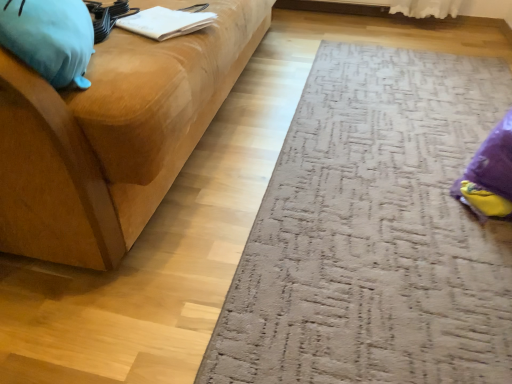
Measure the distance between textured gray doormat at lower right and camera.

The distance of textured gray doormat at lower right from camera is 32.95 inches.

In order to face matte wood studio couch at left, should I rotate leftwards or rightwards?

You should rotate left by 17.257 degrees.

In order to click on soft blue plush at left in this screenshot , I will do `click(50, 38)`.

From the image's perspective, is textured gray doormat at lower right above white paper at upper left?

No.

Which object is closer to the camera, textured gray doormat at lower right or white paper at upper left?

textured gray doormat at lower right is closer to the camera.

Can you confirm if textured gray doormat at lower right is taller than white paper at upper left?

Incorrect, the height of textured gray doormat at lower right is not larger of that of white paper at upper left.

Is soft blue plush at left beside textured gray doormat at lower right?

No, soft blue plush at left is not making contact with textured gray doormat at lower right.

Which object is positioned more to the right, soft blue plush at left or textured gray doormat at lower right?

textured gray doormat at lower right is more to the right.

Which object is closer to the camera taking this photo, soft blue plush at left or textured gray doormat at lower right?

soft blue plush at left is in front.

Does point (68, 5) appear closer or farther from the camera than point (469, 247)?

Point (68, 5) is positioned closer to the camera compared to point (469, 247).

From the picture: Does white paper at upper left have a greater height compared to textured gray doormat at lower right?

Correct, white paper at upper left is much taller as textured gray doormat at lower right.

From the picture: Is white paper at upper left positioned with its back to textured gray doormat at lower right?

That's not correct — white paper at upper left is not looking away from textured gray doormat at lower right.

From a real-world perspective, between white paper at upper left and textured gray doormat at lower right, who is vertically lower?

From a 3D spatial view, textured gray doormat at lower right is below.

Does white paper at upper left appear on the right side of textured gray doormat at lower right?

No.

What's the angular difference between matte wood studio couch at left and soft blue plush at left's facing directions?

The facing directions of matte wood studio couch at left and soft blue plush at left are 20.5 degrees apart.

Between point (108, 227) and point (47, 29), which one is positioned in front?

The point (47, 29) is more forward.

From the image's perspective, who appears lower, matte wood studio couch at left or soft blue plush at left?

soft blue plush at left is shown below in the image.

Are matte wood studio couch at left and soft blue plush at left located far from each other?

Actually, matte wood studio couch at left and soft blue plush at left are a little close together.

From the image's perspective, is soft blue plush at left on white paper at upper left?

No, from the image's perspective, soft blue plush at left is not on top of white paper at upper left.

How different are the orientations of soft blue plush at left and white paper at upper left in degrees?

31.6 degrees.

Is white paper at upper left at the back of soft blue plush at left?

No, soft blue plush at left is not facing away from white paper at upper left.

From a real-world perspective, is soft blue plush at left under white paper at upper left?

No, from a real-world perspective, soft blue plush at left is not beneath white paper at upper left.

Is matte wood studio couch at left next to white paper at upper left and touching it?

No, matte wood studio couch at left is not making contact with white paper at upper left.

Considering the relative sizes of matte wood studio couch at left and white paper at upper left in the image provided, is matte wood studio couch at left shorter than white paper at upper left?

No.

Would you say matte wood studio couch at left contains white paper at upper left?

Yes.

Does matte wood studio couch at left have a lesser width compared to white paper at upper left?

Incorrect, the width of matte wood studio couch at left is not less than that of white paper at upper left.

From the image's perspective, who appears lower, soft blue plush at left or matte wood studio couch at left?

soft blue plush at left appears lower in the image.

Between soft blue plush at left and matte wood studio couch at left, which one appears on the left side from the viewer's perspective?

matte wood studio couch at left.

Based on the photo, do you think soft blue plush at left is within matte wood studio couch at left, or outside of it?

soft blue plush at left fits inside matte wood studio couch at left.

Considering the positions of objects soft blue plush at left and matte wood studio couch at left in the image provided, who is in front, soft blue plush at left or matte wood studio couch at left?

matte wood studio couch at left.

Find the location of a particular element. This screenshot has width=512, height=384. book lying behind the textured gray doormat at lower right is located at coordinates 167,22.

Where is `bean bag chair in front of the textured gray doormat at lower right`? The image size is (512, 384). bean bag chair in front of the textured gray doormat at lower right is located at coordinates (50, 38).

Looking at the image, which one is located closer to textured gray doormat at lower right, matte wood studio couch at left or soft blue plush at left?

Based on the image, matte wood studio couch at left appears to be nearer to textured gray doormat at lower right.

From the image, which object appears to be nearer to soft blue plush at left, white paper at upper left or textured gray doormat at lower right?

white paper at upper left is closer to soft blue plush at left.

Looking at the image, which one is located further to textured gray doormat at lower right, white paper at upper left or matte wood studio couch at left?

Among the two, white paper at upper left is located further to textured gray doormat at lower right.

Consider the image. Which object lies further to the anchor point matte wood studio couch at left, white paper at upper left or soft blue plush at left?

soft blue plush at left is positioned further to the anchor matte wood studio couch at left.

Which object lies nearer to the anchor point textured gray doormat at lower right, soft blue plush at left or white paper at upper left?

white paper at upper left is closer to textured gray doormat at lower right.

Based on their spatial positions, is textured gray doormat at lower right or white paper at upper left closer to soft blue plush at left?

Based on the image, white paper at upper left appears to be nearer to soft blue plush at left.

Looking at the image, which one is located further to white paper at upper left, matte wood studio couch at left or soft blue plush at left?

Result: soft blue plush at left lies further to white paper at upper left than the other object.

From the image, which object appears to be farther from soft blue plush at left, matte wood studio couch at left or white paper at upper left?

Based on the image, white paper at upper left appears to be further to soft blue plush at left.

This screenshot has height=384, width=512. What are the coordinates of `bean bag chair positioned between matte wood studio couch at left and white paper at upper left from near to far` in the screenshot? It's located at (50, 38).

At what (x,y) coordinates should I click in order to perform the action: click on book between matte wood studio couch at left and textured gray doormat at lower right. Please return your answer as a coordinate pair (x, y). Looking at the image, I should click on (167, 22).

At what (x,y) coordinates should I click in order to perform the action: click on bean bag chair between matte wood studio couch at left and textured gray doormat at lower right in the horizontal direction. Please return your answer as a coordinate pair (x, y). The width and height of the screenshot is (512, 384). Looking at the image, I should click on (50, 38).

Find the location of `book between soft blue plush at left and textured gray doormat at lower right from left to right`. book between soft blue plush at left and textured gray doormat at lower right from left to right is located at coordinates (167, 22).